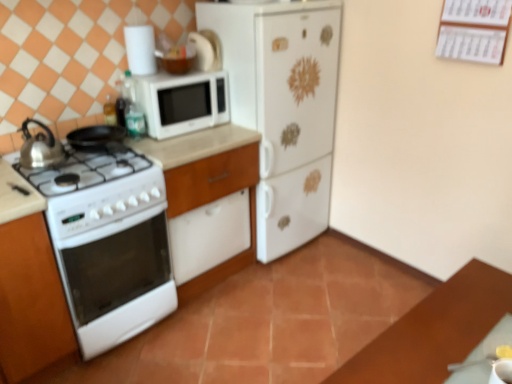
Question: Is the surface of white matte microwave at upper center in direct contact with white glossy countertop at lower left?

Choices:
 (A) no
 (B) yes

Answer: (A)

Question: Is white matte microwave at upper center taller than white glossy countertop at lower left?

Choices:
 (A) yes
 (B) no

Answer: (A)

Question: Is white matte microwave at upper center to the right of white glossy countertop at lower left from the viewer's perspective?

Choices:
 (A) yes
 (B) no

Answer: (A)

Question: Is white glossy countertop at lower left at the back of white matte microwave at upper center?

Choices:
 (A) yes
 (B) no

Answer: (B)

Question: From a real-world perspective, is white matte microwave at upper center positioned under white glossy countertop at lower left based on gravity?

Choices:
 (A) yes
 (B) no

Answer: (B)

Question: Is the position of white matte microwave at upper center more distant than that of white glossy countertop at lower left?

Choices:
 (A) no
 (B) yes

Answer: (B)

Question: From a real-world perspective, is shiny metallic kettle at left physically below white matte cabinet at left?

Choices:
 (A) yes
 (B) no

Answer: (B)

Question: From the image's perspective, is shiny metallic kettle at left beneath white matte cabinet at left?

Choices:
 (A) yes
 (B) no

Answer: (B)

Question: From a real-world perspective, is shiny metallic kettle at left on top of white matte cabinet at left?

Choices:
 (A) yes
 (B) no

Answer: (A)

Question: Does shiny metallic kettle at left have a lesser width compared to white matte cabinet at left?

Choices:
 (A) yes
 (B) no

Answer: (A)

Question: Does shiny metallic kettle at left have a greater height compared to white matte cabinet at left?

Choices:
 (A) yes
 (B) no

Answer: (B)

Question: Is shiny metallic kettle at left oriented towards white matte cabinet at left?

Choices:
 (A) no
 (B) yes

Answer: (A)

Question: Is white glossy dishwasher at center to the right of white matte refrigerator at center from the viewer's perspective?

Choices:
 (A) no
 (B) yes

Answer: (A)